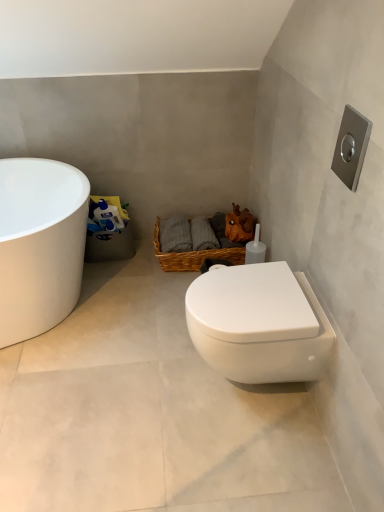
Find the location of a particular element. free point below white glossy toilet at lower right (from a real-world perspective) is located at coordinates (246, 395).